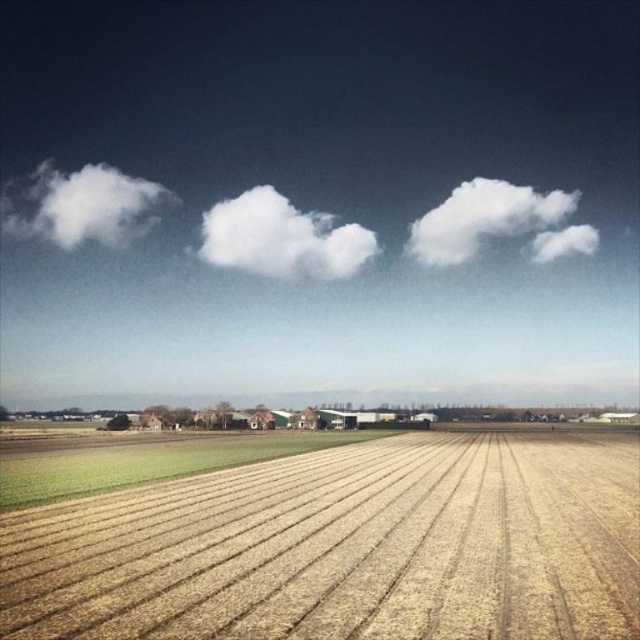
You are standing at the center of the image and want to walk to the green grassy field at lower left. In which cardinal direction should you head?

The green grassy field at lower left is located at coordinates point (147, 461), so you should head southeast to reach it.

You are a farmer planning to plant new crops. You observe the golden textured wheat field at center and the green grassy field at lower left. Which field is closer to you according to the scene?

The golden textured wheat field at center is closer to you because it is in front of the green grassy field at lower left.

You are a farmer standing at the edge of your property and notice both the golden textured wheat field at center and the white fluffy cloud at center. Which object is farther away from you?

The golden textured wheat field at center is 189.31 meters away from the white fluffy cloud at center, so the wheat field is farther away from you than the cloud.